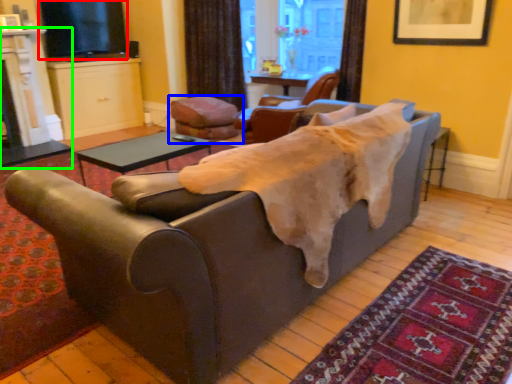
Question: Estimate the real-world distances between objects in this image. Which object is farther from window screen (highlighted by a red box), chair (highlighted by a blue box) or fireplace (highlighted by a green box)?

Choices:
 (A) chair
 (B) fireplace

Answer: (A)